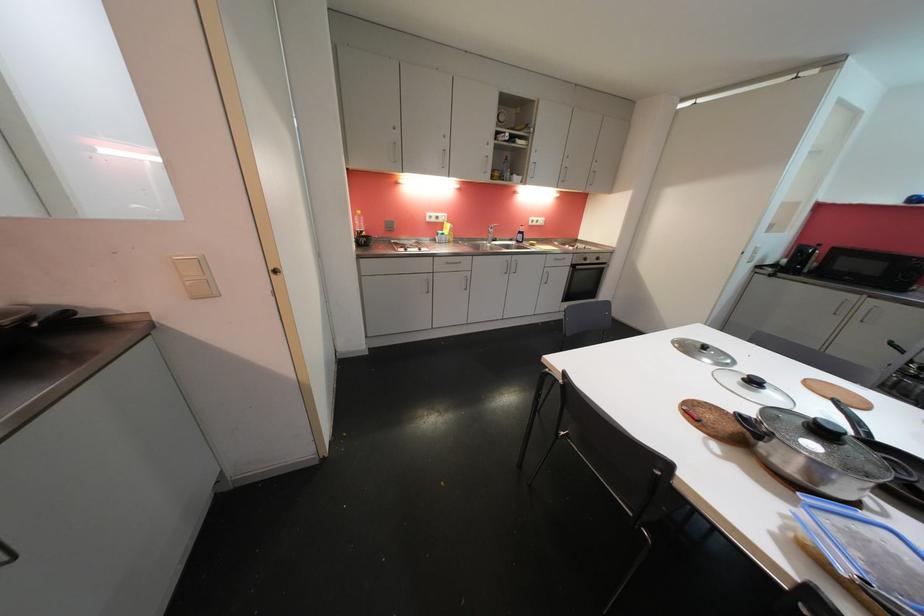
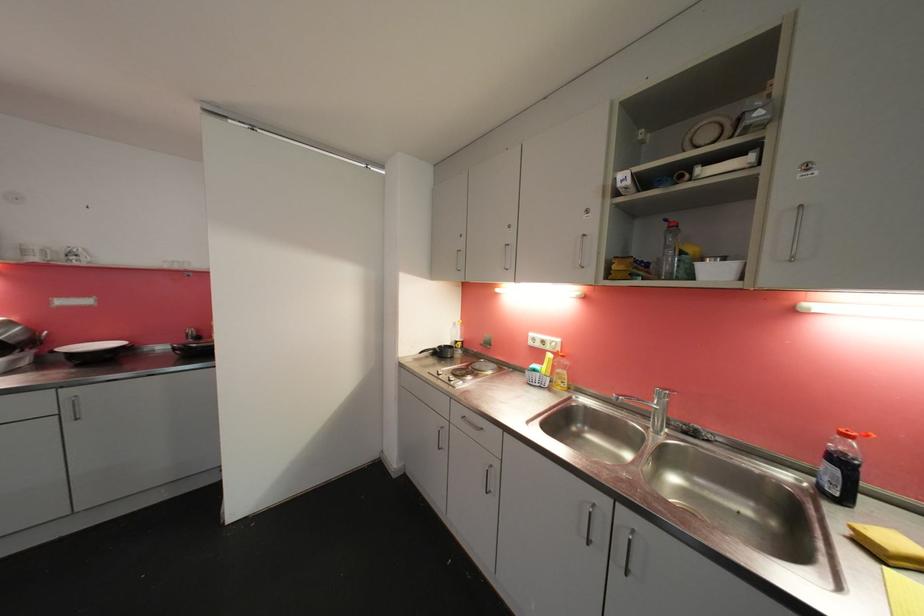
Locate, in the second image, the point that corresponds to (527,232) in the first image.

(850, 450)